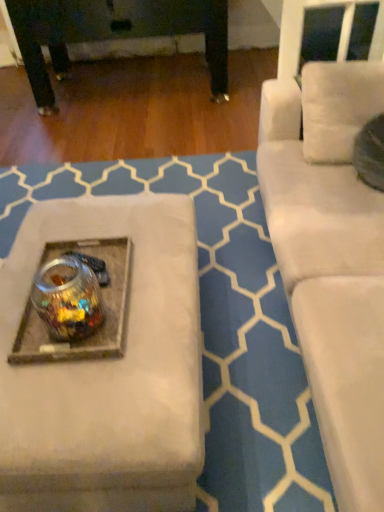
What are the coordinates of `free space to the back side of transparent glass jar at center` in the screenshot? It's located at (107, 271).